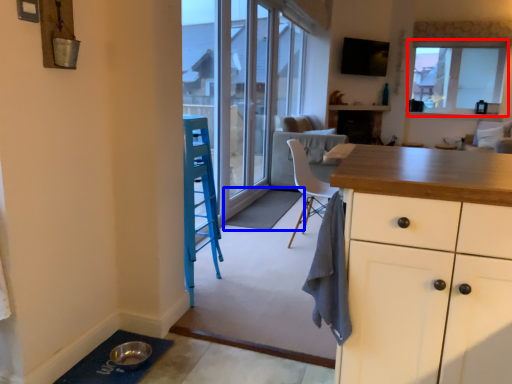
Question: Which object is further to the camera taking this photo, window (highlighted by a red box) or doormat (highlighted by a blue box)?

Choices:
 (A) window
 (B) doormat

Answer: (A)